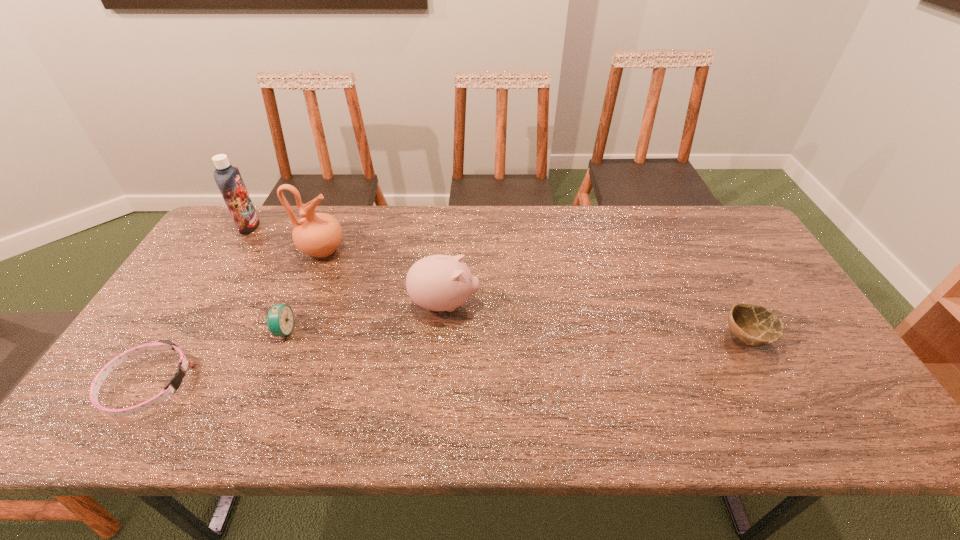
At what (x,y) coordinates should I click in order to perform the action: click on free space between the second shortest object and the piggy bank. Please return your answer as a coordinate pair (x, y). The height and width of the screenshot is (540, 960). Looking at the image, I should click on (595, 321).

The image size is (960, 540). I want to click on vacant space that is in between the shortest object and the pottery, so click(235, 317).

This screenshot has width=960, height=540. What are the coordinates of `vacant area that lies between the dog collar and the second object from right to left` in the screenshot? It's located at (296, 344).

Image resolution: width=960 pixels, height=540 pixels. In order to click on empty space between the piggy bank and the shortest object in this screenshot , I will do `click(296, 344)`.

Find the location of a particular element. vacant space that's between the shampoo and the fifth object from left to right is located at coordinates 347,265.

This screenshot has width=960, height=540. Find the location of `vacant region between the alarm clock and the shortest object`. vacant region between the alarm clock and the shortest object is located at coordinates (216, 357).

Locate which object ranks third in proximity to the bowl. Please provide its 2D coordinates. Your answer should be formatted as a tuple, i.e. [(x, y)], where the tuple contains the x and y coordinates of a point satisfying the conditions above.

[(280, 319)]

Identify which object is the fifth nearest to the shortest object. Please provide its 2D coordinates. Your answer should be formatted as a tuple, i.e. [(x, y)], where the tuple contains the x and y coordinates of a point satisfying the conditions above.

[(754, 325)]